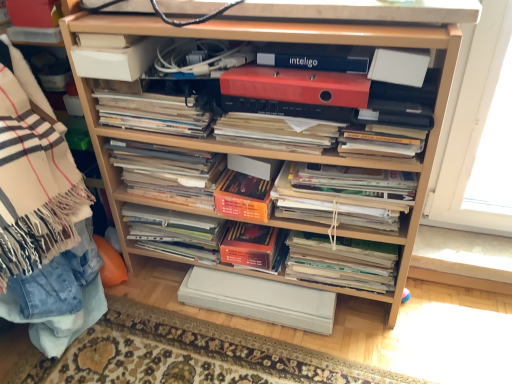
Question: Based on their positions, is white matte paper at upper right, marked as the 4th paperback book in a bottom-to-top arrangement, located to the left or right of matte orange paperback book at center, which appears as the 1th paperback book when ordered from the bottom?

Choices:
 (A) left
 (B) right

Answer: (B)

Question: Is white matte paper at upper right, the fourth paperback book from the top, situated inside matte orange paperback book at center, which appears as the 1th paperback book when ordered from the bottom, or outside?

Choices:
 (A) outside
 (B) inside

Answer: (A)

Question: Which object is positioned farthest from the white matte paper at upper right, the fourth paperback book from the top?

Choices:
 (A) matte red folder at center, the 5th paperback book when ordered from bottom to top
 (B) white paper magazine at center, placed as the 5th magazine when sorted from top to bottom
 (C) blue matte inteligo at upper center, which appears as the second paperback book when viewed from the top
 (D) white matte paper at upper left, the first paperback book in the top-to-bottom sequence
 (E) orange matte paperback book at center, arranged as the fifth paperback book when viewed from the top

Answer: (D)

Question: Which of these objects is positioned closest to the matte paper magazine at lower center, which appears as the first magazine when ordered from the bottom?

Choices:
 (A) wooden shelf at left
 (B) white paper magazine at center, placed as the 5th magazine when sorted from top to bottom
 (C) matte red folder at center, the 5th paperback book when ordered from bottom to top
 (D) matte orange paperback book at center, which appears as the 1th paperback book when ordered from the bottom
 (E) wooden shelf at center

Answer: (D)